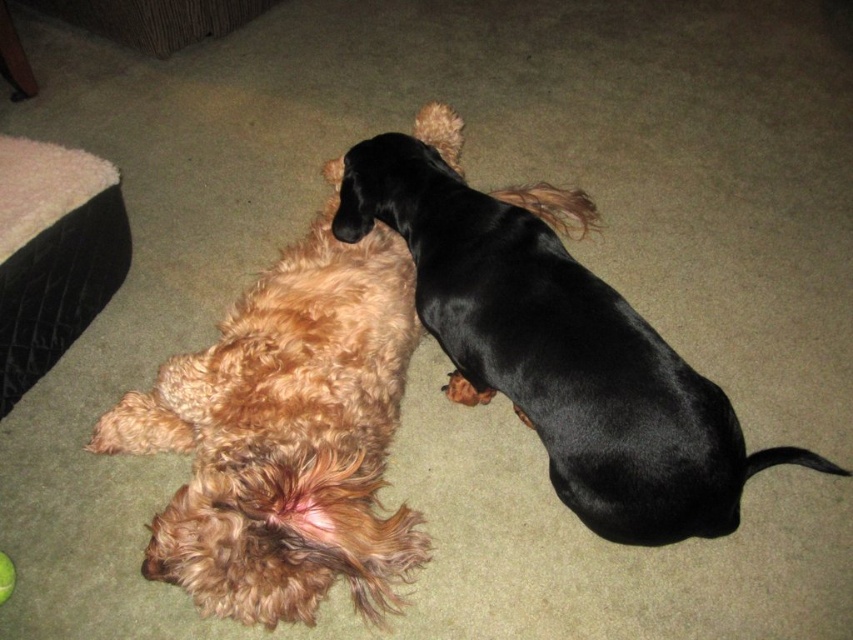
Which is more to the right, fuzzy brown dog at center or black shiny dog at center?

black shiny dog at center is more to the right.

Does fuzzy brown dog at center appear over black shiny dog at center?

No, fuzzy brown dog at center is not above black shiny dog at center.

Find the location of a particular element. Image resolution: width=853 pixels, height=640 pixels. fuzzy brown dog at center is located at coordinates (286, 435).

You are a GUI agent. You are given a task and a screenshot of the screen. Output one action in this format:
    pyautogui.click(x=<x>, y=<y>)
    Task: Click on the fuzzy brown dog at center
    This screenshot has height=640, width=853.
    Given the screenshot: What is the action you would take?
    pyautogui.click(x=286, y=435)

Which is below, black shiny dog at center or black quilted dog bed at left?

black shiny dog at center is lower down.

Can you confirm if black shiny dog at center is taller than black quilted dog bed at left?

Indeed, black shiny dog at center has a greater height compared to black quilted dog bed at left.

Does point (741, 464) come farther from viewer compared to point (103, 163)?

No, it is not.

At what (x,y) coordinates should I click in order to perform the action: click on black shiny dog at center. Please return your answer as a coordinate pair (x, y). Looking at the image, I should click on click(x=555, y=346).

Can you confirm if fuzzy brown dog at center is positioned to the left of black quilted dog bed at left?

In fact, fuzzy brown dog at center is to the right of black quilted dog bed at left.

Does fuzzy brown dog at center appear on the right side of black quilted dog bed at left?

Indeed, fuzzy brown dog at center is positioned on the right side of black quilted dog bed at left.

Locate an element on the screen. fuzzy brown dog at center is located at coordinates (286, 435).

Where is `fuzzy brown dog at center`? This screenshot has height=640, width=853. fuzzy brown dog at center is located at coordinates [x=286, y=435].